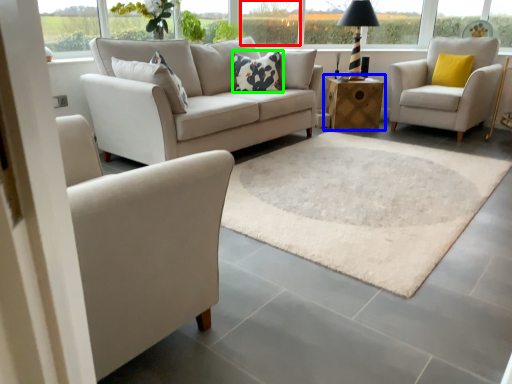
Question: Which is farther away from window (highlighted by a red box)? table (highlighted by a blue box) or pillow (highlighted by a green box)?

Choices:
 (A) table
 (B) pillow

Answer: (B)